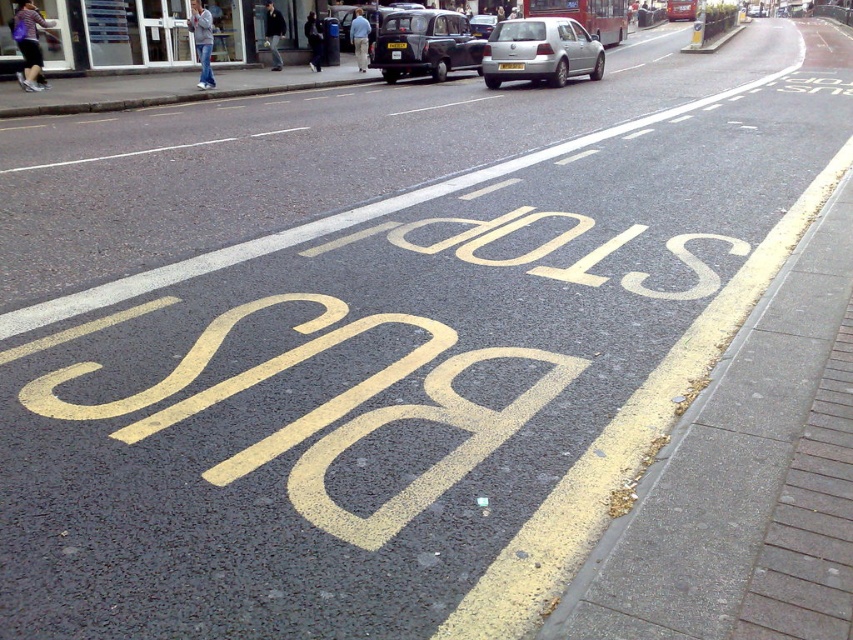
Between silver metallic hatchback at center and black matte taxi at center, which one has more height?

With more height is black matte taxi at center.

Can you confirm if silver metallic hatchback at center is positioned above black matte taxi at center?

No.

Does point (535, 45) come farther from viewer compared to point (456, 38)?

That is False.

This screenshot has height=640, width=853. What are the coordinates of `silver metallic hatchback at center` in the screenshot? It's located at (540, 51).

Is gray concrete curb at upper center bigger than black matte taxi at center?

Correct, gray concrete curb at upper center is larger in size than black matte taxi at center.

Who is positioned more to the left, gray concrete curb at upper center or black matte taxi at center?

gray concrete curb at upper center is more to the left.

The image size is (853, 640). Find the location of `gray concrete curb at upper center`. gray concrete curb at upper center is located at coordinates (165, 90).

Identify the location of gray concrete curb at upper center. (165, 90).

Can you confirm if gray concrete curb at upper center is smaller than silver metallic hatchback at center?

Incorrect, gray concrete curb at upper center is not smaller in size than silver metallic hatchback at center.

Who is shorter, gray concrete curb at upper center or silver metallic hatchback at center?

silver metallic hatchback at center

Identify the location of gray concrete curb at upper center. Image resolution: width=853 pixels, height=640 pixels. (165, 90).

The width and height of the screenshot is (853, 640). What are the coordinates of `gray concrete curb at upper center` in the screenshot? It's located at (165, 90).